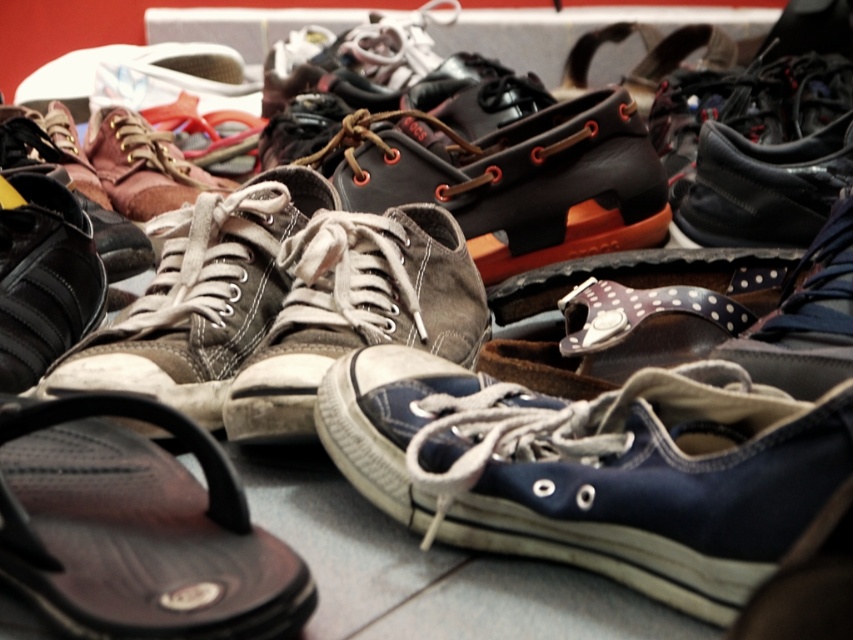
Question: From the image, what is the correct spatial relationship of navy canvas sneaker at center in relation to matte black sneaker at lower left?

Choices:
 (A) below
 (B) above

Answer: (A)

Question: Which point is closer to the camera taking this photo?

Choices:
 (A) (692, 577)
 (B) (78, 353)

Answer: (A)

Question: Is black rubber flip-flop at lower left below matte black sneaker at lower left?

Choices:
 (A) yes
 (B) no

Answer: (A)

Question: Which object appears farthest from the camera in this image?

Choices:
 (A) brown suede sneaker at center-left
 (B) matte black sneaker at lower left

Answer: (B)

Question: Which object is farther from the camera taking this photo?

Choices:
 (A) navy canvas sneaker at center
 (B) matte black sneaker at lower left
 (C) brown suede sneaker at center-left

Answer: (B)

Question: Does brown suede sneaker at center-left lie in front of matte black sneaker at lower left?

Choices:
 (A) no
 (B) yes

Answer: (B)